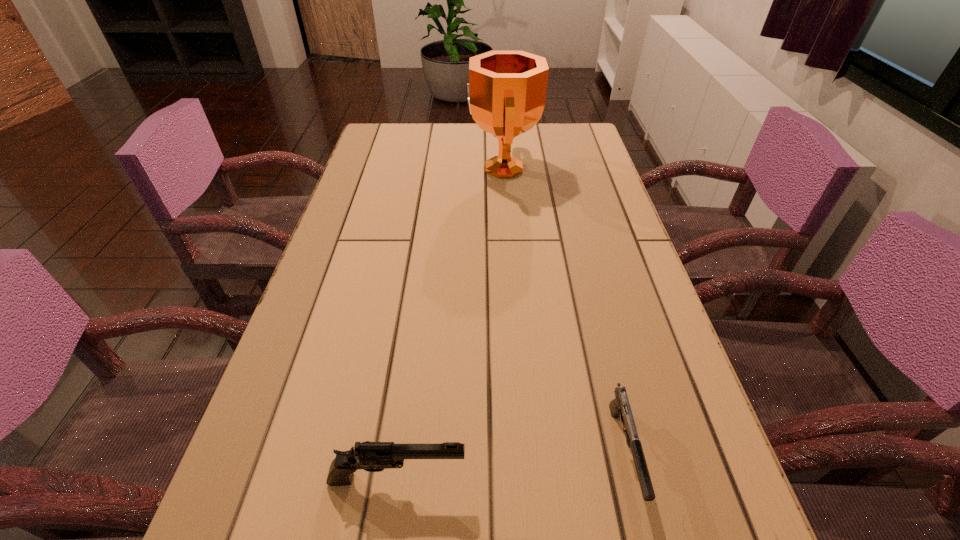
Where is `blank region between the left gun and the farthest object`? blank region between the left gun and the farthest object is located at coordinates (450, 323).

This screenshot has height=540, width=960. I want to click on blank region between the left gun and the farthest object, so click(450, 323).

Find the location of a particular element. The width and height of the screenshot is (960, 540). unoccupied area between the farthest object and the shortest object is located at coordinates (564, 310).

The width and height of the screenshot is (960, 540). Identify the location of empty location between the right gun and the farthest object. (564, 310).

At what (x,y) coordinates should I click in order to perform the action: click on vacant region between the rightmost object and the farthest object. Please return your answer as a coordinate pair (x, y). Image resolution: width=960 pixels, height=540 pixels. Looking at the image, I should click on (564, 310).

The width and height of the screenshot is (960, 540). I want to click on free area in between the left gun and the shortest object, so pyautogui.click(x=511, y=465).

Locate an element on the screen. This screenshot has width=960, height=540. unoccupied area between the farthest object and the rightmost object is located at coordinates pyautogui.click(x=564, y=310).

Identify which object is located as the second nearest to the tallest object. Please provide its 2D coordinates. Your answer should be formatted as a tuple, i.e. [(x, y)], where the tuple contains the x and y coordinates of a point satisfying the conditions above.

[(370, 456)]

This screenshot has width=960, height=540. Identify the location of object that is the nearest to the right gun. (370, 456).

Identify the location of vacant point that satisfies the following two spatial constraints: 1. at the muzzle end of the rightmost object; 2. at the end of the barrel of the taller gun. (631, 478).